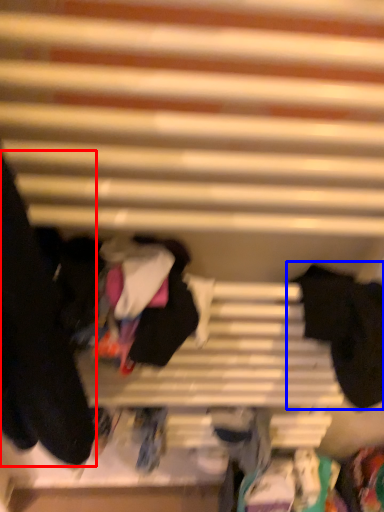
Question: Among these objects, which one is farthest to the camera, clothing (highlighted by a red box) or clothing (highlighted by a blue box)?

Choices:
 (A) clothing
 (B) clothing

Answer: (B)